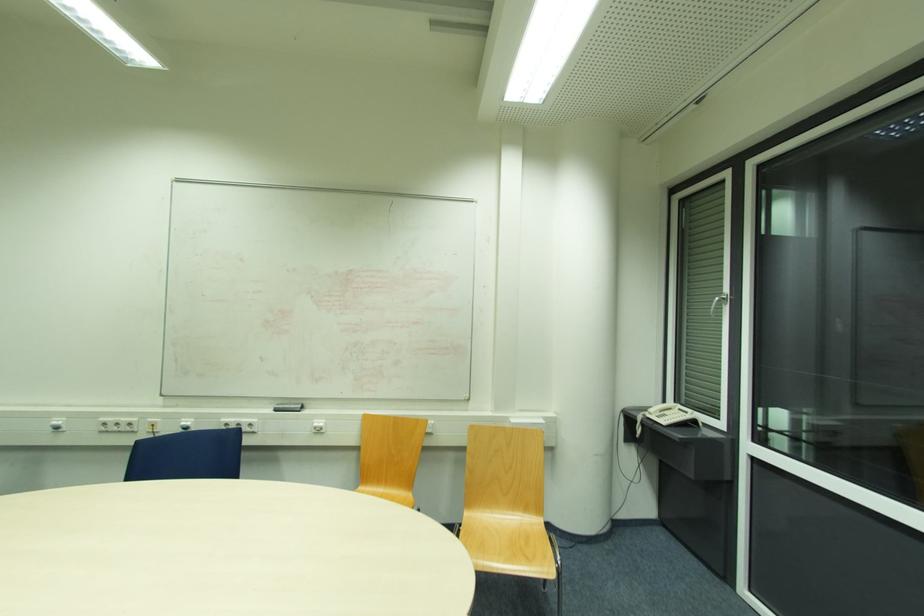
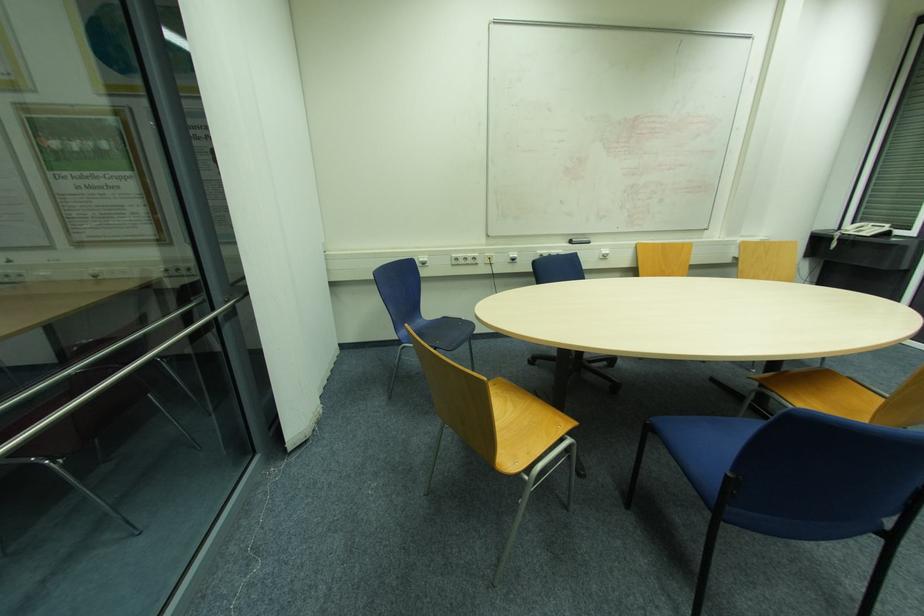
Locate, in the second image, the point that corresponds to point 276,411 in the first image.

(574, 244)